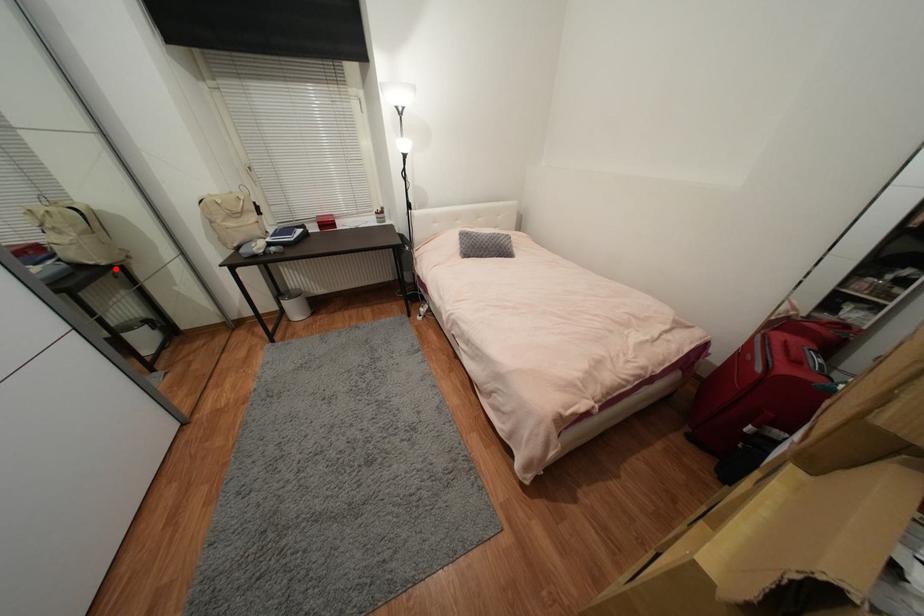
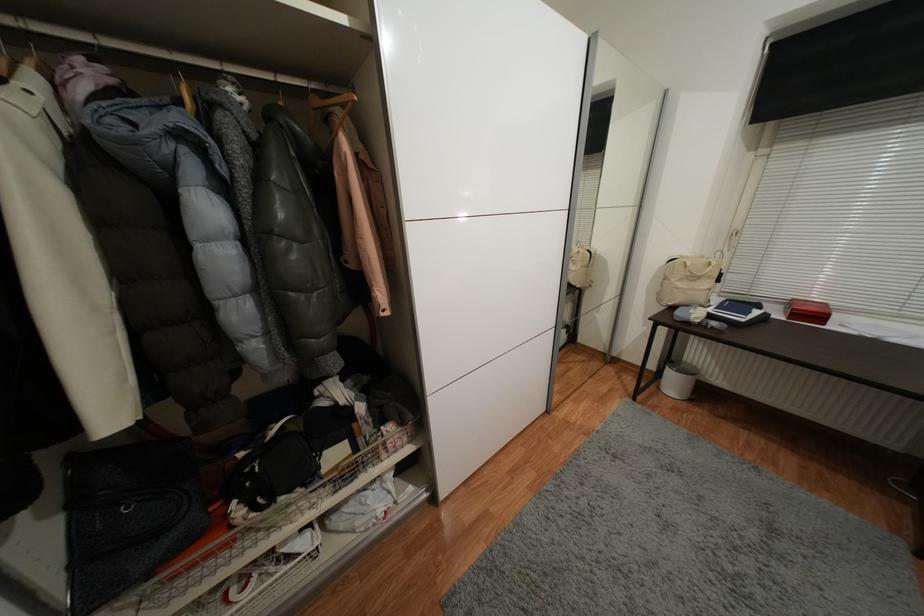
Question: I am providing you with two images of the same scene from different viewpoints. Given a red point in image1, look at the same physical point in image2. Is it:

Choices:
 (A) Closer to the viewpoint
 (B) Farther from the viewpoint

Answer: (B)